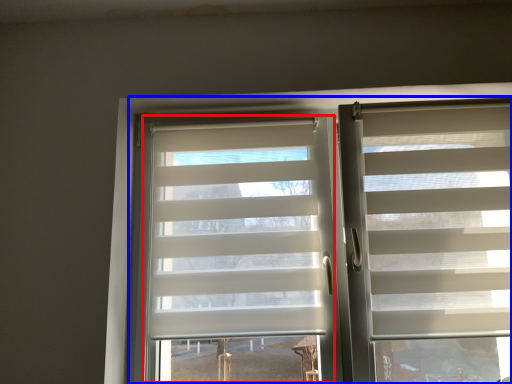
Question: Among these objects, which one is nearest to the camera, glass door (highlighted by a red box) or bay window (highlighted by a blue box)?

Choices:
 (A) glass door
 (B) bay window

Answer: (B)